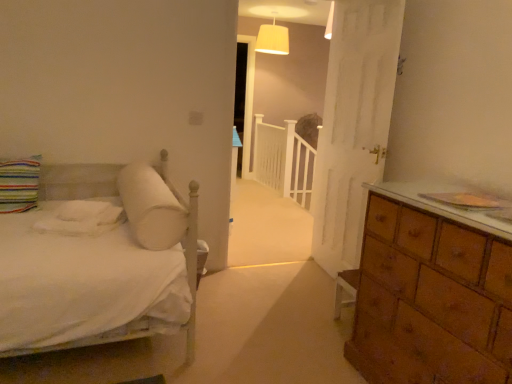
Question: From the image's perspective, is white fabric lampshade at upper center located above or below white cotton sheet at left?

Choices:
 (A) above
 (B) below

Answer: (A)

Question: Considering their positions, is white fabric lampshade at upper center located in front of or behind white cotton sheet at left?

Choices:
 (A) front
 (B) behind

Answer: (B)

Question: Estimate the real-world distances between objects in this image. Which object is closer to the white fabric lampshade at upper center?

Choices:
 (A) white soft pillow at upper left, positioned as the second pillow in left-to-right order
 (B) striped fabric pillow at left, marked as the 1th pillow in a left-to-right arrangement
 (C) white cotton sheet at left

Answer: (A)

Question: Which is nearer to the striped fabric pillow at left, which ranks as the 2th pillow in right-to-left order?

Choices:
 (A) white fabric lampshade at upper center
 (B) white cotton sheet at left
 (C) white soft pillow at upper left, positioned as the second pillow in left-to-right order

Answer: (B)